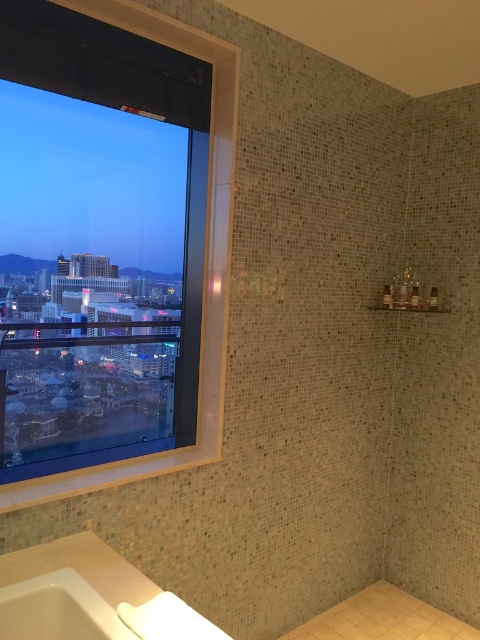
You are standing in the bathroom and want to reach a point that is 2 meters away from you. Is the point at coordinate point (210, 182) within your reach?

The distance of point (210, 182) from camera is 2.05 meters, so the point is slightly beyond your reach since it is 2.05 meters away from your current position.

Consider the image. You are designing a layout for a bathroom magazine spread. The editor wants to highlight the transparent glass window at left and the white ceramic bath at lower left. Since space is limited, you need to decide which object to feature more prominently. Based on their sizes, which object should you choose to emphasize in the layout?

The transparent glass window at left is bigger than the white ceramic bath at lower left, so you should emphasize the transparent glass window at left in the layout to reflect its prominence in the scene.

You are standing in the bathroom and want to look outside through the transparent glass window at left. Where should you stand to see the cityscape view?

The transparent glass window at left is located at coordinates point (x=204, y=264), so you should position yourself near that point to view the cityscape outside.